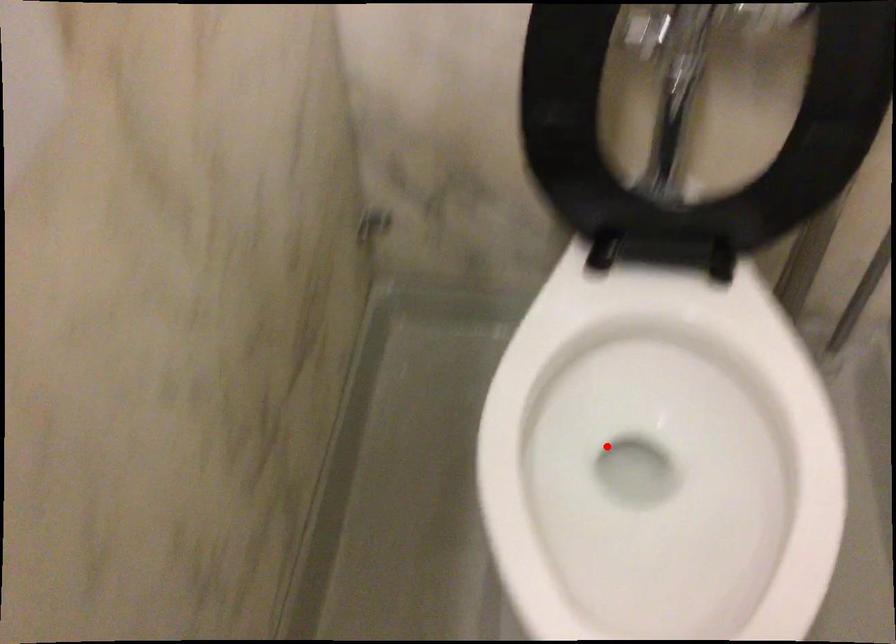
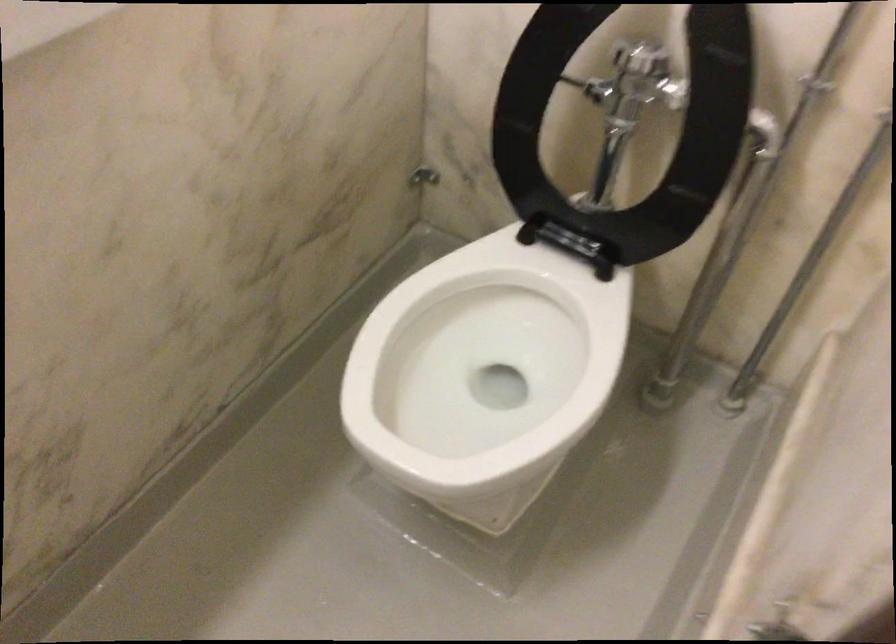
Locate, in the second image, the point that corresponds to the highlighted location in the first image.

(481, 366)